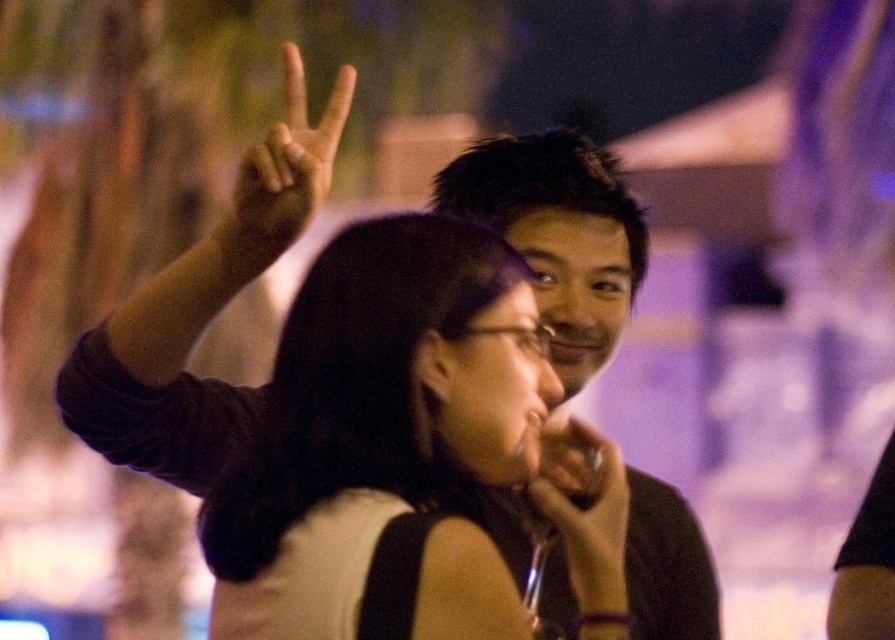
You are a photographer trying to capture a clear shot of both the black matte hair at center and the matte black hand at upper center in this scene. Based on their sizes, which object should you focus on first to ensure both are in focus?

The black matte hair at center is larger than the matte black hand at upper center. To ensure both are in focus, you should focus on the larger object first, which is the black matte hair at center, as it requires more precise focus due to its size.

You are taking a photo of the two people in the scene. You want to adjust your camera to focus on the matte black shirt at center and the black matte hair at upper center. Which object should you focus on first to ensure both are in focus?

The matte black shirt at center is to the right of black matte hair at upper center. To ensure both are in focus, focus on the black matte hair at upper center first since it is closer to the camera, allowing the depth of field to cover the matte black shirt at center which is further away.